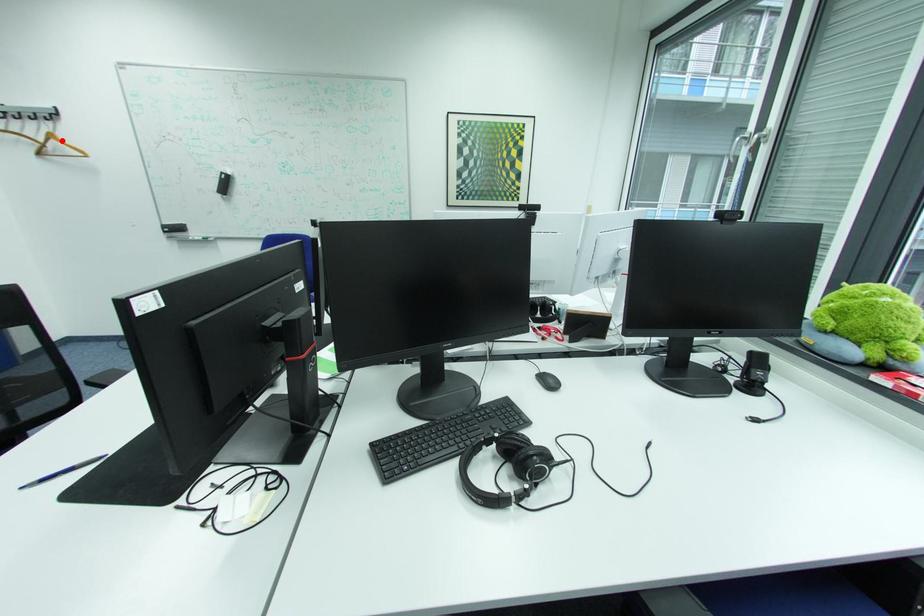
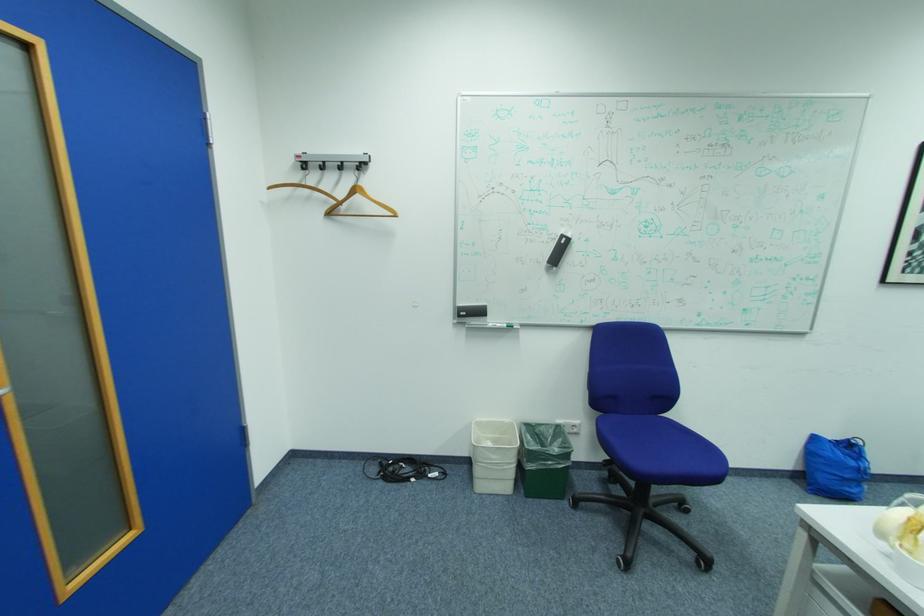
Question: I am providing you with two images of the same scene from different viewpoints. Given a red point in image1, look at the same physical point in image2. Is it:

Choices:
 (A) Closer to the viewpoint
 (B) Farther from the viewpoint

Answer: (A)